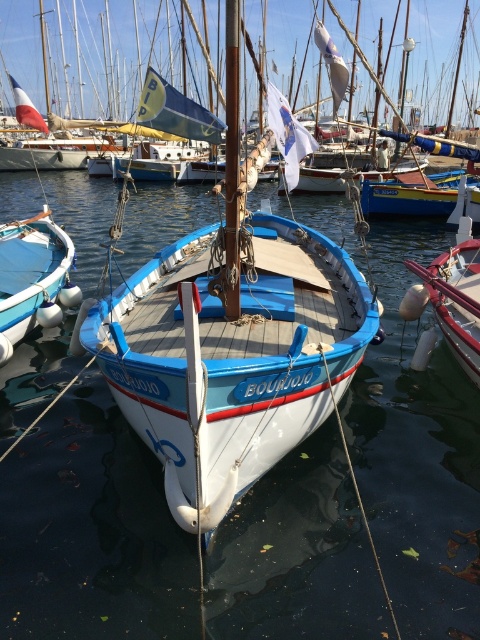
Question: Can you confirm if clear blue water at center is smaller than white wooden boat at center?

Choices:
 (A) yes
 (B) no

Answer: (B)

Question: Which point is closer to the camera?

Choices:
 (A) (472, 246)
 (B) (259, 451)
 (C) (463, 624)
 (D) (17, 230)

Answer: (C)

Question: Can you confirm if clear blue water at center is thinner than white glossy buoy at center?

Choices:
 (A) no
 (B) yes

Answer: (A)

Question: Can you confirm if clear blue water at center is positioned to the right of white wooden boat at center?

Choices:
 (A) yes
 (B) no

Answer: (A)

Question: Which of the following is the farthest from the observer?

Choices:
 (A) (458, 317)
 (B) (59, 308)

Answer: (B)

Question: Among these objects, which one is nearest to the camera?

Choices:
 (A) white matte boat at left
 (B) white glossy buoy at center
 (C) clear blue water at center
 (D) white wooden boat at center

Answer: (D)